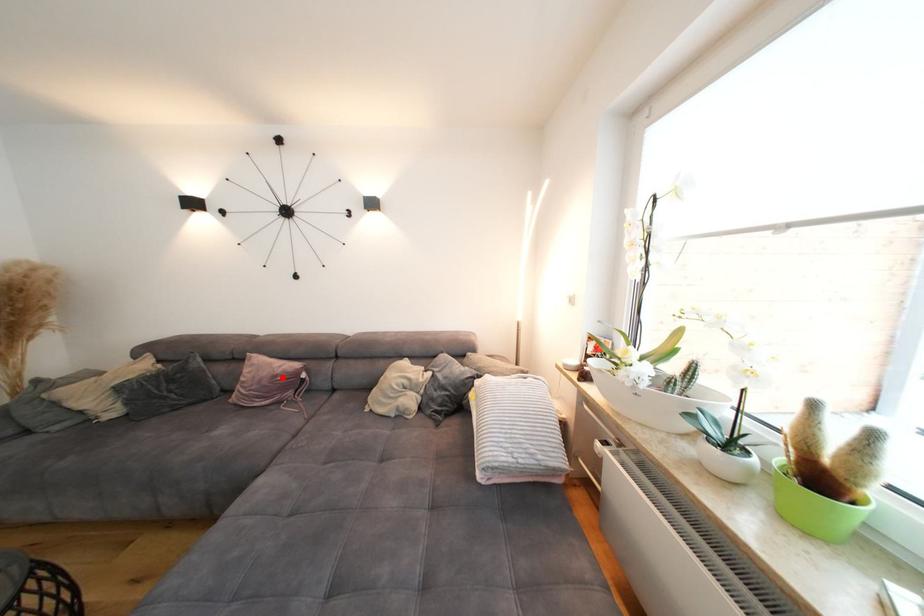
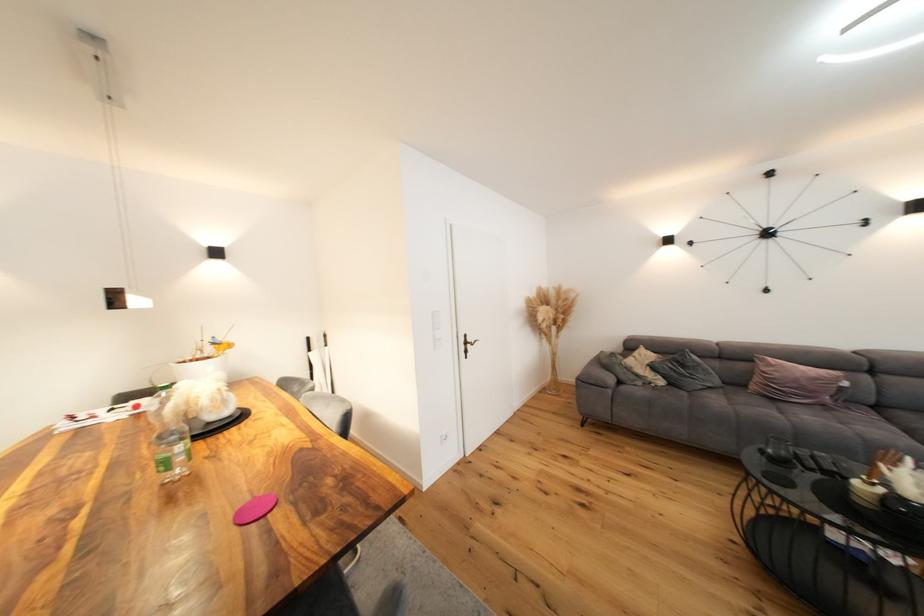
In the second image, find the point that corresponds to the highlighted location in the first image.

(822, 381)